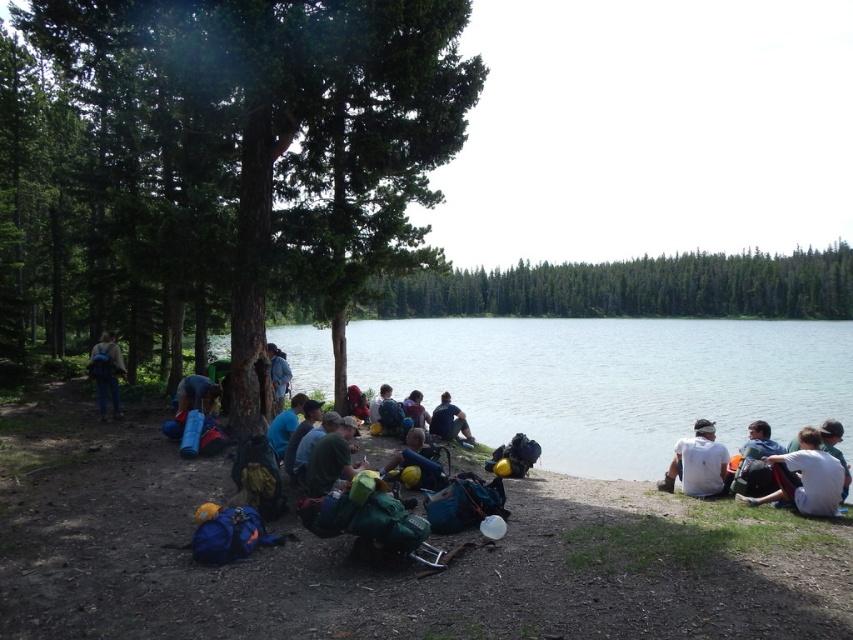
Question: Considering the real-world distances, which object is closest to the green fabric backpack at lower right?

Choices:
 (A) white cotton shirt at lower right
 (B) clear water at lake center

Answer: (A)

Question: Which object is the farthest from the yellow fabric mat at center?

Choices:
 (A) white cotton shirt at lower right
 (B) matte blue backpack at center
 (C) green textured pine tree at center
 (D) white matte shirt at lower right

Answer: (C)

Question: Is clear water at lake center smaller than green textured pine tree at center?

Choices:
 (A) yes
 (B) no

Answer: (A)

Question: Is white cotton shirt at lower right positioned at the back of matte green backpack at center?

Choices:
 (A) yes
 (B) no

Answer: (B)

Question: Which is nearer to the blue fabric shirt at center?

Choices:
 (A) clear water at lake center
 (B) yellow fabric mat at center

Answer: (B)

Question: Is green textured tree at left positioned at the back of matte green backpack at center?

Choices:
 (A) no
 (B) yes

Answer: (A)